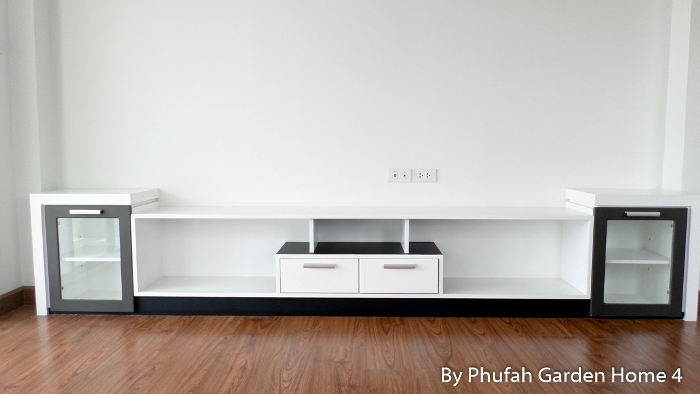
Locate an element on the screen. outlet is located at coordinates (432, 170).